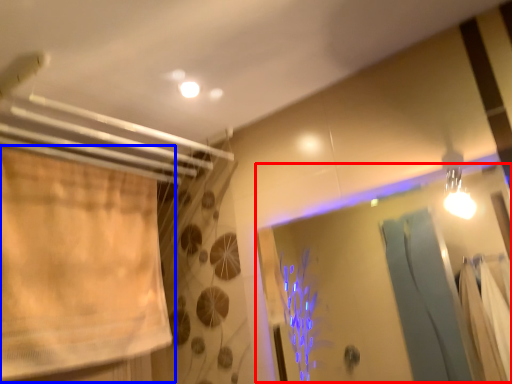
Question: Which of the following is the farthest to the observer, screen door (highlighted by a red box) or curtain (highlighted by a blue box)?

Choices:
 (A) screen door
 (B) curtain

Answer: (B)